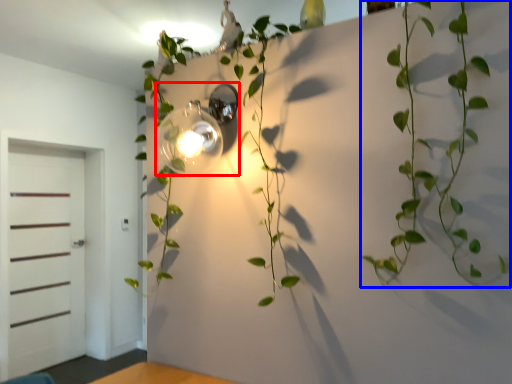
Question: Which of the following is the closest to the observer, light fixture (highlighted by a red box) or houseplant (highlighted by a blue box)?

Choices:
 (A) light fixture
 (B) houseplant

Answer: (B)